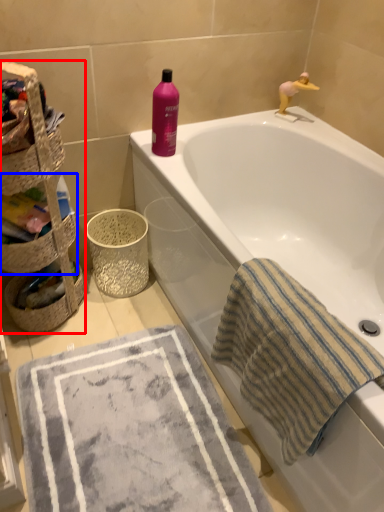
Question: Among these objects, which one is nearest to the camera, basket (highlighted by a red box) or basket (highlighted by a blue box)?

Choices:
 (A) basket
 (B) basket

Answer: (A)